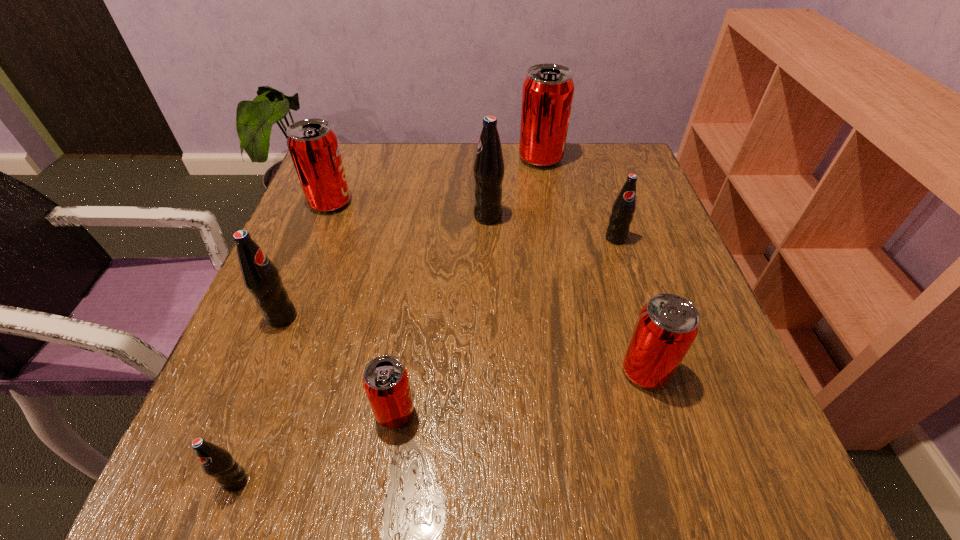
You are a GUI agent. You are given a task and a screenshot of the screen. Output one action in this format:
    pyautogui.click(x=<x>, y=<y>)
    Task: Click on the free space that satisfies the following two spatial constraints: 1. on the back side of the smallest red soda can; 2. on the right side of the sixth farthest pop
    
    Given the screenshot: What is the action you would take?
    pyautogui.click(x=400, y=371)

What are the coordinates of `vacant space that satisfies the following two spatial constraints: 1. on the front label of the second farthest black pop; 2. on the front label of the third farthest black pop` in the screenshot? It's located at (640, 317).

The height and width of the screenshot is (540, 960). I want to click on free space that satisfies the following two spatial constraints: 1. on the front label of the third farthest red soda can; 2. on the left side of the fourth pop from right to left, so click(492, 371).